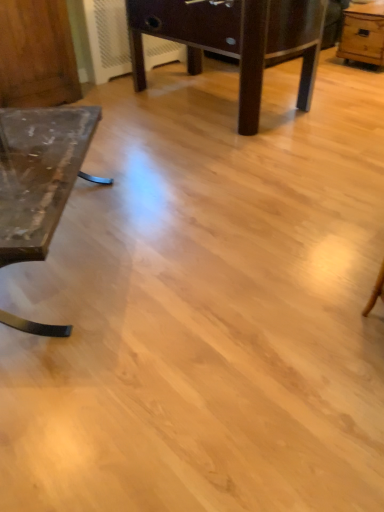
Question: Which direction should I rotate to look at dark brown wooden table at center, the 2th table viewed from the left?

Choices:
 (A) right
 (B) left

Answer: (A)

Question: Can you confirm if matte glass table at left, acting as the first table starting from the left, is wider than wooden dresser at left?

Choices:
 (A) yes
 (B) no

Answer: (A)

Question: From the image's perspective, is matte glass table at left, placed as the third table when sorted from right to left, under wooden dresser at left?

Choices:
 (A) no
 (B) yes

Answer: (B)

Question: Does matte glass table at left, placed as the third table when sorted from right to left, have a lesser width compared to wooden dresser at left?

Choices:
 (A) yes
 (B) no

Answer: (B)

Question: Is wooden dresser at left a part of matte glass table at left, placed as the third table when sorted from right to left?

Choices:
 (A) no
 (B) yes

Answer: (A)

Question: Can you confirm if matte glass table at left, placed as the third table when sorted from right to left, is taller than wooden dresser at left?

Choices:
 (A) yes
 (B) no

Answer: (B)

Question: Is matte glass table at left, acting as the first table starting from the left, closer to the viewer compared to wooden dresser at left?

Choices:
 (A) no
 (B) yes

Answer: (B)

Question: Is wooden dresser at left positioned before matte glass table at left, acting as the first table starting from the left?

Choices:
 (A) yes
 (B) no

Answer: (B)

Question: Does wooden dresser at left have a greater width compared to matte glass table at left, placed as the third table when sorted from right to left?

Choices:
 (A) yes
 (B) no

Answer: (B)

Question: From a real-world perspective, does wooden dresser at left stand above matte glass table at left, acting as the first table starting from the left?

Choices:
 (A) no
 (B) yes

Answer: (B)

Question: Is wooden dresser at left shorter than matte glass table at left, acting as the first table starting from the left?

Choices:
 (A) yes
 (B) no

Answer: (B)

Question: From a real-world perspective, is wooden dresser at left located beneath matte glass table at left, acting as the first table starting from the left?

Choices:
 (A) yes
 (B) no

Answer: (B)

Question: Is wooden dresser at left to the left of matte glass table at left, placed as the third table when sorted from right to left, from the viewer's perspective?

Choices:
 (A) yes
 (B) no

Answer: (A)

Question: Considering the relative positions of dark brown wooden table at center, the 2th table viewed from the left, and light brown wooden table at upper right, arranged as the first table when viewed from the right, in the image provided, is dark brown wooden table at center, the 2th table viewed from the left, to the left of light brown wooden table at upper right, arranged as the first table when viewed from the right, from the viewer's perspective?

Choices:
 (A) yes
 (B) no

Answer: (A)